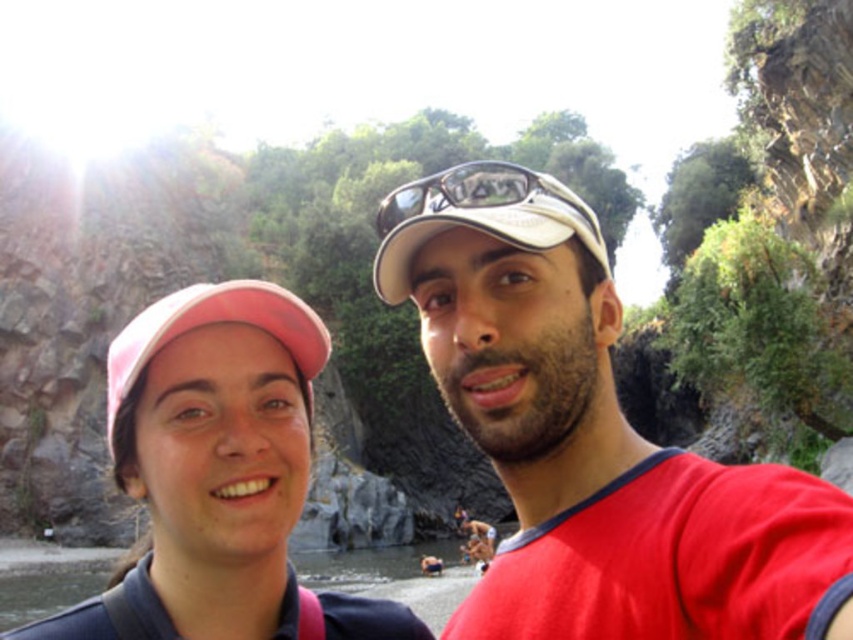
You are a photographer standing at the edge of the river and want to take a photo of the matte red shirt at center and the matte black goggles at center. If your camera has a maximum focus range of 25 feet, will you be able to capture both objects in focus at the same time?

The matte red shirt at center and the matte black goggles at center are 24.83 feet apart. Since the distance between them is within the camera maximum focus range of 25 feet, the camera can capture both objects in focus simultaneously.

You are a photographer trying to capture a clear shot of both the pink fabric cap at upper left and the matte black goggles at center. Since the goggles are partially obscured by something, can you determine which object is nearer to the camera based on their positions?

The pink fabric cap at upper left is closer to the viewer than matte black goggles at center, so it will appear in front of the goggles in the photo.